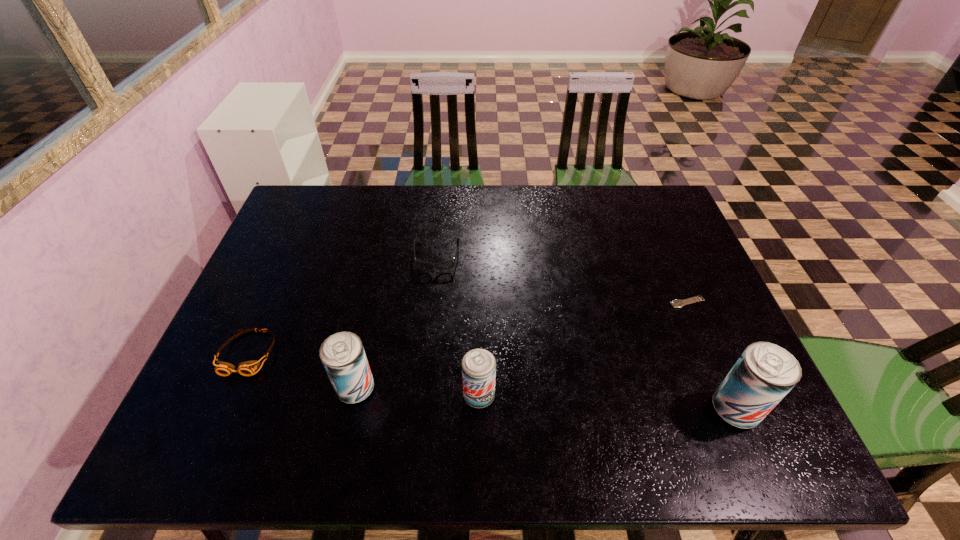
At what (x,y) coordinates should I click in order to perform the action: click on the second object from left to right. Please return your answer as a coordinate pair (x, y). This screenshot has width=960, height=540. Looking at the image, I should click on (342, 354).

The image size is (960, 540). In order to click on the second tallest object in this screenshot , I will do `click(342, 354)`.

Find the location of a particular element. This screenshot has height=540, width=960. the third object from right to left is located at coordinates (478, 365).

Find the location of a particular element. This screenshot has width=960, height=540. the third tallest object is located at coordinates (478, 365).

Locate an element on the screen. the rightmost beer can is located at coordinates point(764,374).

Identify the location of the fifth nearest object. The height and width of the screenshot is (540, 960). tap(675, 303).

The image size is (960, 540). Find the location of `the shortest object`. the shortest object is located at coordinates (675, 303).

I want to click on spectacles, so click(x=445, y=265).

You are a GUI agent. You are given a task and a screenshot of the screen. Output one action in this format:
    pyautogui.click(x=<x>, y=<y>)
    Task: Click on the farthest object
    The height and width of the screenshot is (540, 960).
    Given the screenshot: What is the action you would take?
    pyautogui.click(x=445, y=265)

Where is `goggles`? Image resolution: width=960 pixels, height=540 pixels. goggles is located at coordinates (247, 368).